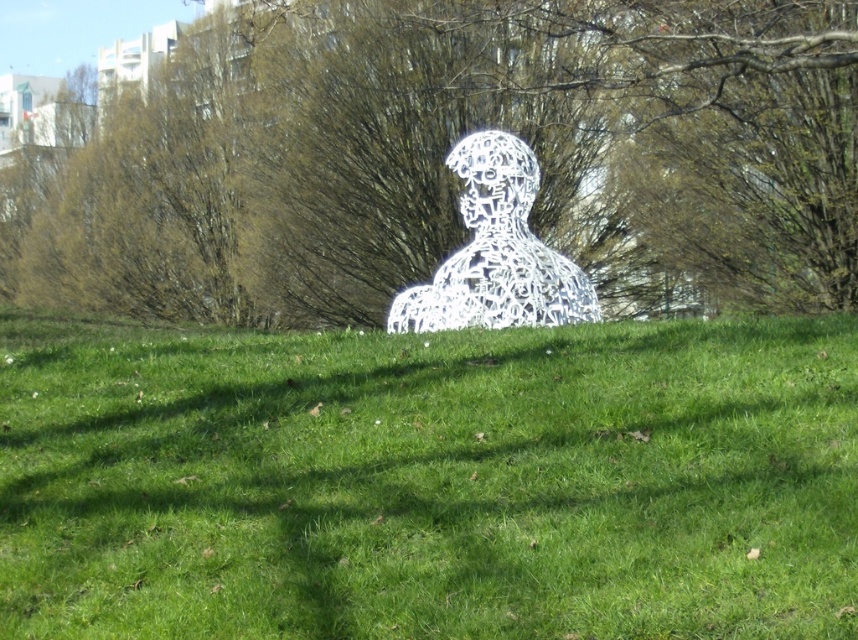
Can you confirm if green grass at center is thinner than green leafy tree at center?

Indeed, green grass at center has a lesser width compared to green leafy tree at center.

Is green grass at center below green leafy tree at center?

Correct, green grass at center is located below green leafy tree at center.

Which is behind, point (468, 392) or point (393, 138)?

Point (393, 138)

At what (x,y) coordinates should I click in order to perform the action: click on green grass at center. Please return your answer as a coordinate pair (x, y). Image resolution: width=858 pixels, height=640 pixels. Looking at the image, I should click on (433, 483).

Is green leafy tree at center wider than white metallic sculpture at center?

Yes, green leafy tree at center is wider than white metallic sculpture at center.

You are a GUI agent. You are given a task and a screenshot of the screen. Output one action in this format:
    pyautogui.click(x=<x>, y=<y>)
    Task: Click on the green leafy tree at center
    Image resolution: width=858 pixels, height=640 pixels.
    Given the screenshot: What is the action you would take?
    pyautogui.click(x=448, y=148)

This screenshot has width=858, height=640. Find the location of `green leafy tree at center`. green leafy tree at center is located at coordinates (448, 148).

Does green grass at center appear on the right side of white metallic sculpture at center?

No, green grass at center is not to the right of white metallic sculpture at center.

Describe the element at coordinates (433, 483) in the screenshot. The height and width of the screenshot is (640, 858). I see `green grass at center` at that location.

What are the coordinates of `green grass at center` in the screenshot? It's located at pyautogui.click(x=433, y=483).